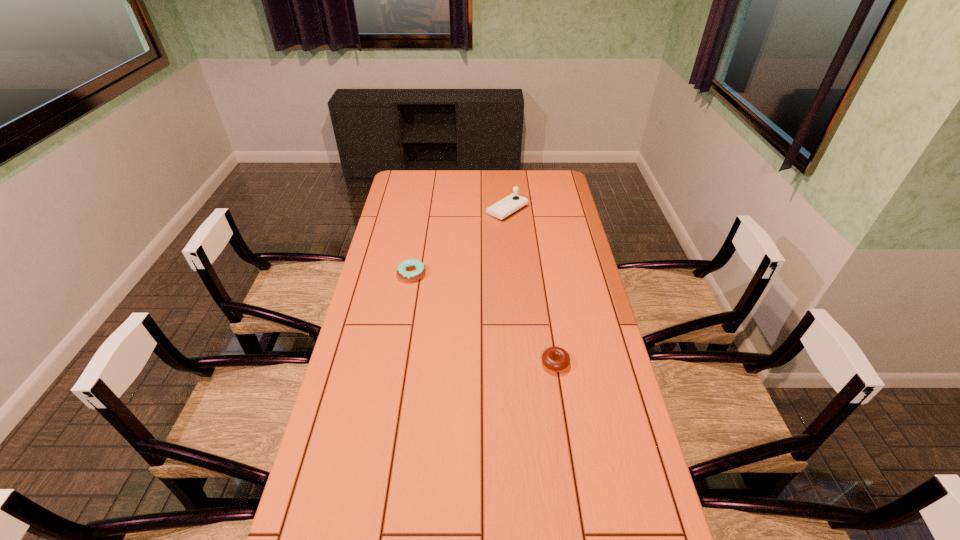
Where is `object located at the right edge`? This screenshot has width=960, height=540. object located at the right edge is located at coordinates (556, 359).

At what (x,y) coordinates should I click in order to perform the action: click on free location at the far edge. Please return your answer as a coordinate pair (x, y). The image size is (960, 540). Looking at the image, I should click on (431, 175).

This screenshot has width=960, height=540. In the image, there is a desktop. In order to click on vacant space at the left edge in this screenshot , I will do `click(411, 213)`.

Find the location of a particular element. This screenshot has height=540, width=960. free space at the right edge is located at coordinates (568, 239).

The image size is (960, 540). I want to click on vacant space at the far left corner of the desktop, so click(408, 189).

What are the coordinates of `vacant space that's between the nearer doughnut and the farthest object` in the screenshot? It's located at pos(531,287).

Find the location of a particular element. vacant point located between the farthest object and the right doughnut is located at coordinates (531, 287).

You are a GUI agent. You are given a task and a screenshot of the screen. Output one action in this format:
    pyautogui.click(x=<x>, y=<y>)
    Task: Click on the free point between the joystick and the farther doughnut
    The image size is (960, 540).
    Given the screenshot: What is the action you would take?
    pyautogui.click(x=460, y=242)

Where is `free space between the farthest object and the nearer doughnut`? free space between the farthest object and the nearer doughnut is located at coordinates (531, 287).

Select which object appears as the second closest to the farthest object. Please provide its 2D coordinates. Your answer should be formatted as a tuple, i.e. [(x, y)], where the tuple contains the x and y coordinates of a point satisfying the conditions above.

[(556, 359)]